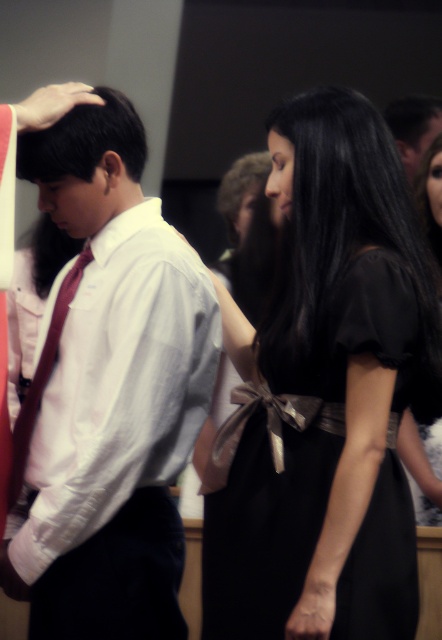
Question: Which point is closer to the camera?

Choices:
 (A) (359, 608)
 (B) (79, 456)
 (C) (73, 292)
 (D) (426, 467)

Answer: (A)

Question: Is shiny black dress at center bigger than matte red tie at center?

Choices:
 (A) yes
 (B) no

Answer: (B)

Question: Which point appears farthest from the camera in this image?

Choices:
 (A) (355, 506)
 (B) (71, 298)
 (C) (118, 572)
 (D) (423, 208)

Answer: (D)

Question: Is black satin dress at center to the left of matte red tie at center from the viewer's perspective?

Choices:
 (A) yes
 (B) no

Answer: (B)

Question: Which of the following is the farthest from the observer?

Choices:
 (A) black satin dress at center
 (B) shiny black dress at center
 (C) matte red tie at center
 (D) white satin shirt at center

Answer: (B)

Question: Does black satin dress at center have a larger size compared to white satin shirt at center?

Choices:
 (A) no
 (B) yes

Answer: (B)